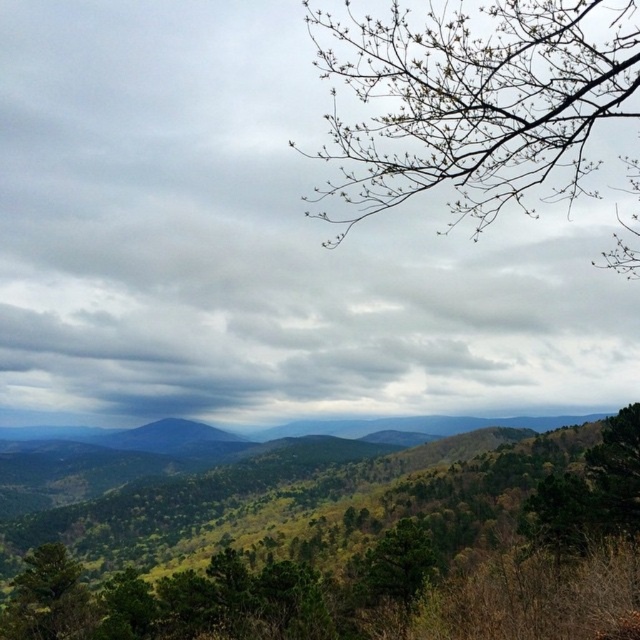
Can you confirm if green leafy tree at center is positioned to the left of bare branches at upper right?

Indeed, green leafy tree at center is positioned on the left side of bare branches at upper right.

Can you confirm if green leafy tree at center is positioned above bare branches at upper right?

No, green leafy tree at center is not above bare branches at upper right.

What do you see at coordinates (376, 552) in the screenshot? I see `green leafy tree at center` at bounding box center [376, 552].

Identify the location of green leafy tree at center. Image resolution: width=640 pixels, height=640 pixels. (376, 552).